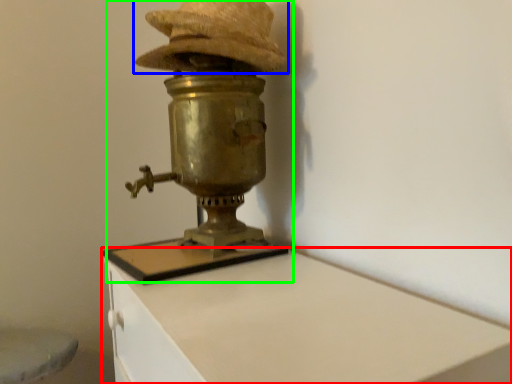
Question: Estimate the real-world distances between objects in this image. Which object is closer to furniture (highlighted by a red box), hat (highlighted by a blue box) or table lamp (highlighted by a green box)?

Choices:
 (A) hat
 (B) table lamp

Answer: (B)